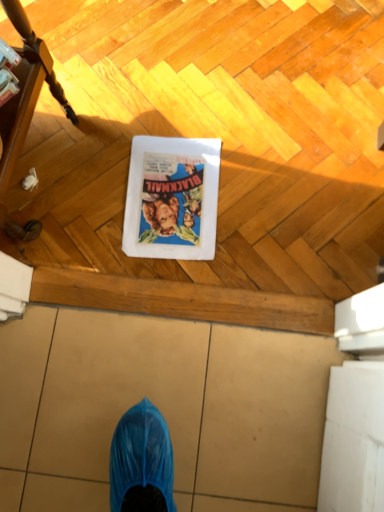
Measure the distance between point (51, 66) and camera.

Point (51, 66) and camera are 34.41 inches apart.

This screenshot has width=384, height=512. Describe the element at coordinates (26, 90) in the screenshot. I see `brushed wood table at left` at that location.

In order to click on brushed wood table at left in this screenshot , I will do `click(26, 90)`.

This screenshot has width=384, height=512. What do you see at coordinates (172, 198) in the screenshot? I see `matte paper comic book at center` at bounding box center [172, 198].

Identify the location of matte paper comic book at center. This screenshot has height=512, width=384. (172, 198).

What are the coordinates of `brushed wood table at left` in the screenshot? It's located at (26, 90).

In the image, is matte paper comic book at center on the left side or the right side of brushed wood table at left?

Based on their positions, matte paper comic book at center is located to the right of brushed wood table at left.

From the picture: Relative to brushed wood table at left, is matte paper comic book at center in front or behind?

Clearly, matte paper comic book at center is behind brushed wood table at left.

Considering the points (172, 162) and (42, 82), which point is in front, point (172, 162) or point (42, 82)?

The point (42, 82) is closer.

From the image's perspective, between matte paper comic book at center and brushed wood table at left, who is located below?

matte paper comic book at center is shown below in the image.

From a real-world perspective, which object stands above the other?

brushed wood table at left, from a real-world perspective.

Is matte paper comic book at center wider than brushed wood table at left?

No.

In terms of height, does matte paper comic book at center look taller or shorter compared to brushed wood table at left?

Considering their sizes, matte paper comic book at center has less height than brushed wood table at left.

Who is smaller, matte paper comic book at center or brushed wood table at left?

With smaller size is matte paper comic book at center.

Is matte paper comic book at center located outside brushed wood table at left?

Yes, matte paper comic book at center is not within brushed wood table at left.

Can you see matte paper comic book at center touching brushed wood table at left?

matte paper comic book at center and brushed wood table at left are not in contact.

Does matte paper comic book at center turn towards brushed wood table at left?

No, matte paper comic book at center is not aimed at brushed wood table at left.

How different are the orientations of matte paper comic book at center and brushed wood table at left in degrees?

171 degrees separate the facing orientations of matte paper comic book at center and brushed wood table at left.

Measure the distance from matte paper comic book at center to brushed wood table at left.

matte paper comic book at center and brushed wood table at left are 29.51 centimeters apart.

Where is `furniture that appears above the matte paper comic book at center (from a real-world perspective)`? The width and height of the screenshot is (384, 512). furniture that appears above the matte paper comic book at center (from a real-world perspective) is located at coordinates (26, 90).

Considering the positions of objects brushed wood table at left and matte paper comic book at center in the image provided, who is more to the right, brushed wood table at left or matte paper comic book at center?

matte paper comic book at center is more to the right.

Considering their positions, is brushed wood table at left located in front of or behind matte paper comic book at center?

brushed wood table at left is positioned closer to the viewer than matte paper comic book at center.

Does point (12, 18) come in front of point (212, 258)?

Yes, it is in front of point (212, 258).

From the image's perspective, between brushed wood table at left and matte paper comic book at center, which one is located above?

brushed wood table at left is shown above in the image.

From a real-world perspective, is brushed wood table at left on top of matte paper comic book at center?

Indeed, from a real-world perspective, brushed wood table at left stands above matte paper comic book at center.

Does brushed wood table at left have a greater width compared to matte paper comic book at center?

Correct, the width of brushed wood table at left exceeds that of matte paper comic book at center.

Who is shorter, brushed wood table at left or matte paper comic book at center?

Standing shorter between the two is matte paper comic book at center.

Who is smaller, brushed wood table at left or matte paper comic book at center?

matte paper comic book at center.

Which is correct: brushed wood table at left is inside matte paper comic book at center, or outside of it?

brushed wood table at left cannot be found inside matte paper comic book at center.

Based on the photo, is brushed wood table at left directly adjacent to matte paper comic book at center?

They are not placed beside each other.

Is brushed wood table at left oriented away from matte paper comic book at center?

No, brushed wood table at left is not facing the opposite direction of matte paper comic book at center.

What's the angular difference between brushed wood table at left and matte paper comic book at center's facing directions?

The angular difference between brushed wood table at left and matte paper comic book at center is 171 degrees.

Locate an element on the screen. The height and width of the screenshot is (512, 384). comic book character lying on the right of brushed wood table at left is located at coordinates (172, 198).

At what (x,y) coordinates should I click in order to perform the action: click on furniture positioned vertically above the matte paper comic book at center (from a real-world perspective). Please return your answer as a coordinate pair (x, y). This screenshot has height=512, width=384. Looking at the image, I should click on (26, 90).

Identify the location of furniture on the left of the matte paper comic book at center. (26, 90).